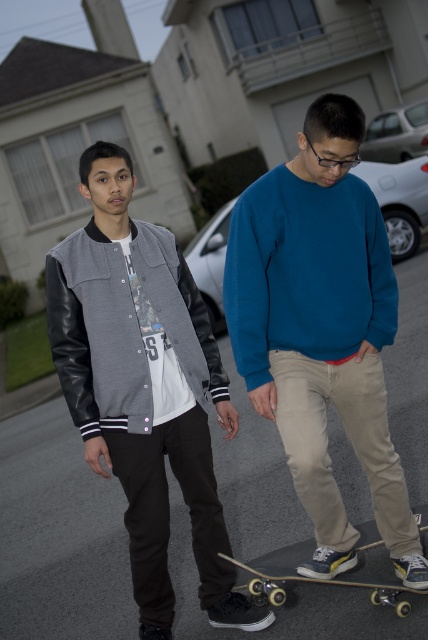
Question: Does blue cotton sweatshirt at center appear over gray fabric jacket at center?

Choices:
 (A) no
 (B) yes

Answer: (B)

Question: Which of the following is the closest to the observer?

Choices:
 (A) wooden skateboard at lower center
 (B) gray fabric jacket at center
 (C) blue cotton sweatshirt at center

Answer: (C)

Question: Considering the relative positions of blue cotton sweatshirt at center and gray fabric jacket at center in the image provided, where is blue cotton sweatshirt at center located with respect to gray fabric jacket at center?

Choices:
 (A) right
 (B) left

Answer: (A)

Question: Does gray fabric jacket at center have a larger size compared to wooden skateboard at lower center?

Choices:
 (A) yes
 (B) no

Answer: (A)

Question: Which object appears closest to the camera in this image?

Choices:
 (A) wooden skateboard at lower center
 (B) gray fabric jacket at center
 (C) blue cotton sweatshirt at center

Answer: (C)

Question: Which point is farther to the camera?

Choices:
 (A) (136, 452)
 (B) (273, 604)

Answer: (B)